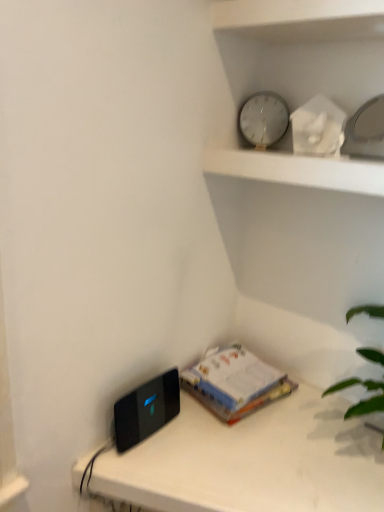
Where is `blank space situated above white paper at center (from a real-world perspective)`? blank space situated above white paper at center (from a real-world perspective) is located at coordinates (219, 360).